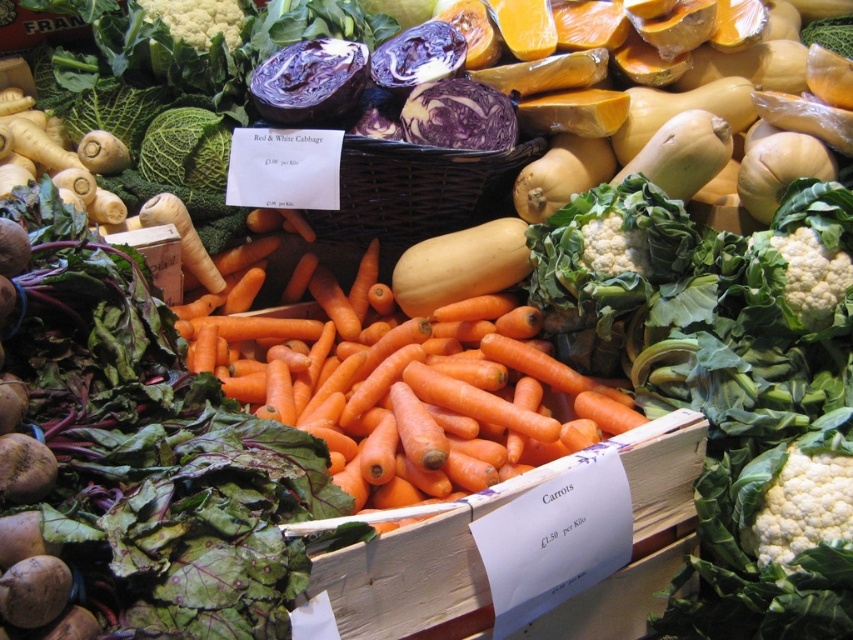
You are a customer at the market stall and want to buy the vegetables that are thinner. Which one should you choose between the white leafy broccoli at lower right and the purple smooth cabbage at center?

The white leafy broccoli at lower right is thinner than the purple smooth cabbage at center, so you should choose the white leafy broccoli at lower right.